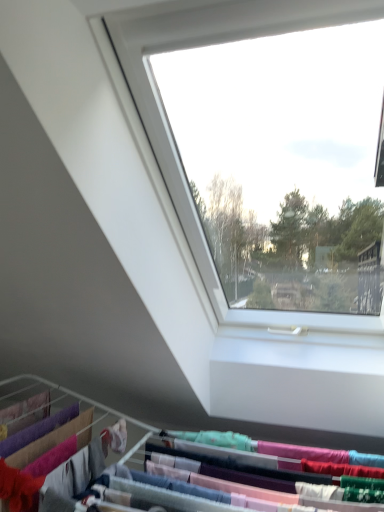
The image size is (384, 512). Describe the element at coordinates (123, 487) in the screenshot. I see `polyester hangers at lower center` at that location.

Identify the location of polyester hangers at lower center. The width and height of the screenshot is (384, 512). (123, 487).

Measure the distance between polyester hangers at lower center and camera.

polyester hangers at lower center is 39.01 inches from camera.

What is the approximate height of polyester hangers at lower center?

34.08 centimeters.

This screenshot has height=512, width=384. I want to click on polyester hangers at lower center, so click(x=123, y=487).